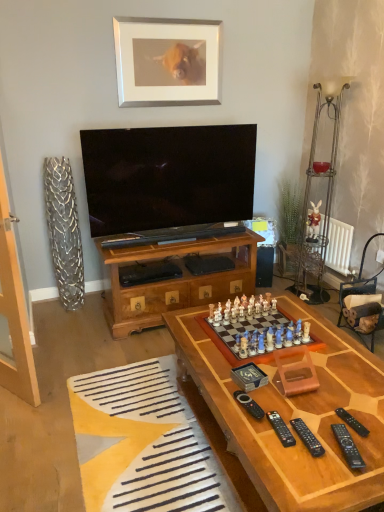
Image resolution: width=384 pixels, height=512 pixels. Find the location of `spots to the right of black plastic remote at lower right, the first remote when ordered from right to left`. spots to the right of black plastic remote at lower right, the first remote when ordered from right to left is located at coordinates (370, 417).